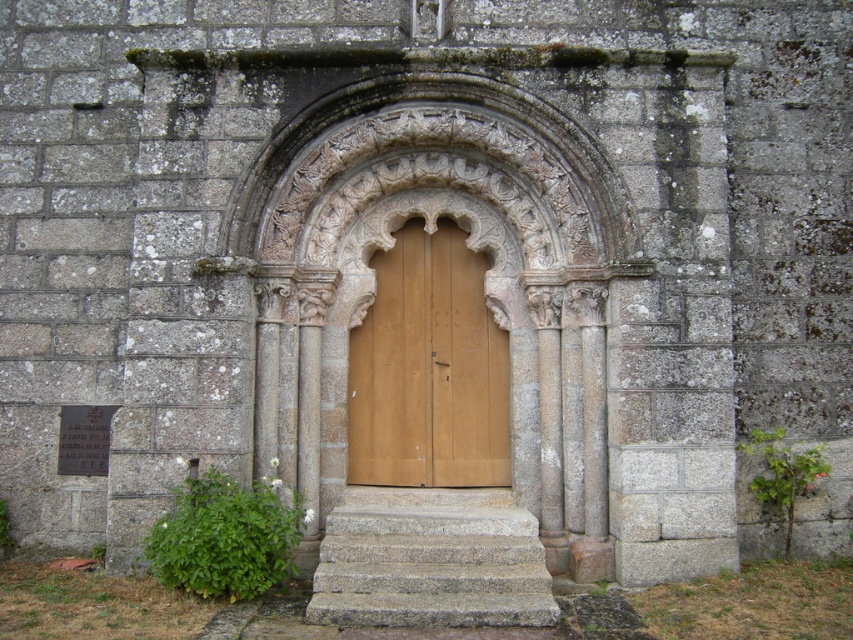
Question: Can you confirm if wooden door at center is positioned to the left of gray stone stairs at center?

Choices:
 (A) no
 (B) yes

Answer: (B)

Question: Does wooden door at center appear under gray stone stairs at center?

Choices:
 (A) yes
 (B) no

Answer: (B)

Question: Which of the following is the closest to the observer?

Choices:
 (A) gray stone stairs at center
 (B) wooden door at center

Answer: (A)

Question: Does wooden door at center appear under gray stone stairs at center?

Choices:
 (A) no
 (B) yes

Answer: (A)

Question: Which point is closer to the camera taking this photo?

Choices:
 (A) (354, 476)
 (B) (412, 506)

Answer: (B)